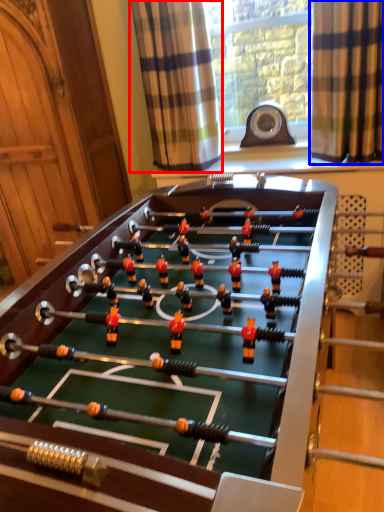
Question: Which of the following is the closest to the observer, curtain (highlighted by a red box) or curtain (highlighted by a blue box)?

Choices:
 (A) curtain
 (B) curtain

Answer: (B)